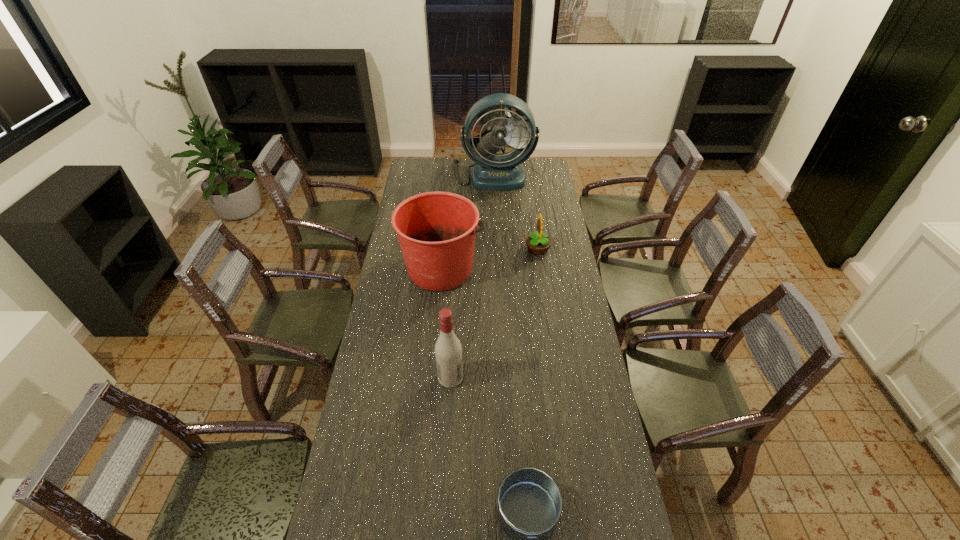
You are a GUI agent. You are given a task and a screenshot of the screen. Output one action in this format:
    pyautogui.click(x=<x>, y=<y>)
    Task: Click on the tallest object
    The width and height of the screenshot is (960, 540).
    Given the screenshot: What is the action you would take?
    pyautogui.click(x=493, y=171)

Find the location of a particular element. the farthest object is located at coordinates (493, 171).

Locate an element on the screen. alcohol is located at coordinates (448, 351).

This screenshot has width=960, height=540. Find the location of `bucket`. bucket is located at coordinates (436, 231).

Identify the location of sunflower. (538, 243).

At what (x,y) coordinates should I click in order to perform the action: click on vacant space located 0.280m in front of the fan to blow air. Please return your answer as a coordinate pair (x, y). Image resolution: width=960 pixels, height=540 pixels. Looking at the image, I should click on (495, 221).

I want to click on blank area located on the label of the alcohol, so click(x=526, y=377).

Locate an element on the screen. Image resolution: width=960 pixels, height=540 pixels. free spot located on the front of the bucket is located at coordinates (435, 346).

This screenshot has width=960, height=540. Identify the location of free location located 0.230m on the face of the fourth tallest object. (475, 248).

The width and height of the screenshot is (960, 540). In order to click on vacant region located 0.050m on the face of the fourth tallest object in this screenshot , I will do `click(515, 248)`.